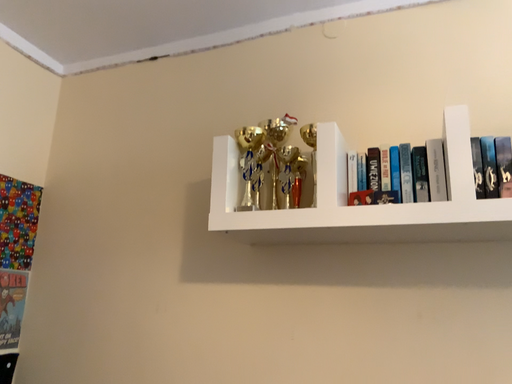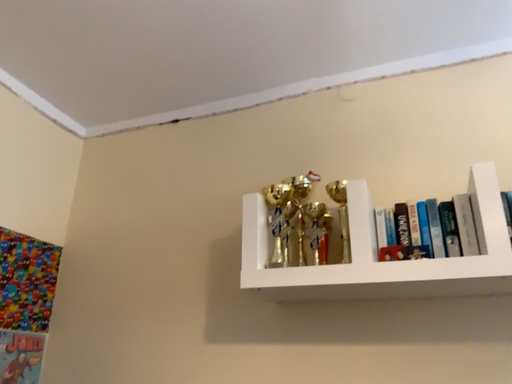
Question: How did the camera likely rotate when shooting the video?

Choices:
 (A) rotated downward
 (B) rotated upward

Answer: (B)